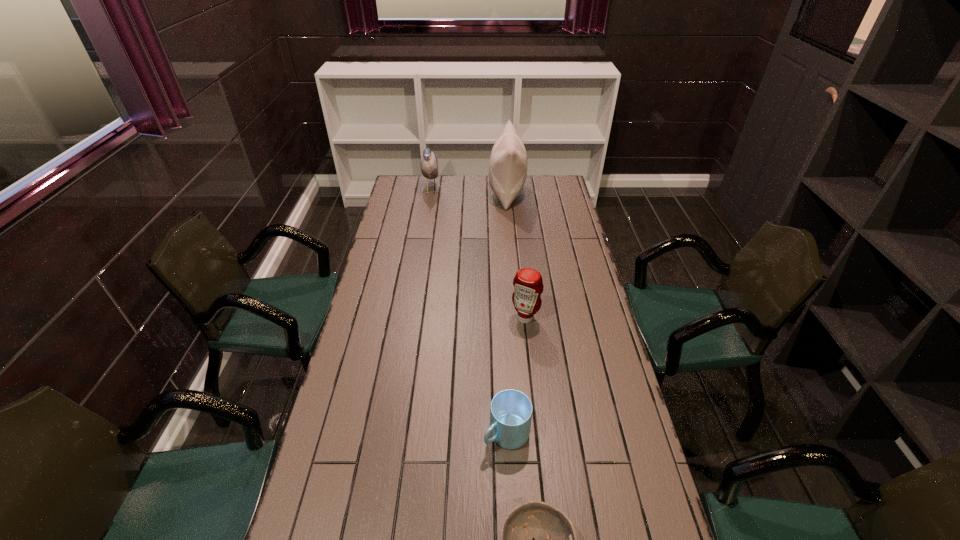
Locate an element on the screen. free space located on the back of the third nearest object is located at coordinates (518, 252).

Find the location of a particular element. free space located 0.280m on the right of the fourth farthest object is located at coordinates pos(628,434).

At what (x,y) coordinates should I click in order to perform the action: click on cushion that is at the far edge. Please return your answer as a coordinate pair (x, y). This screenshot has width=960, height=540. Looking at the image, I should click on (508, 162).

Locate an element on the screen. The width and height of the screenshot is (960, 540). bird that is at the far edge is located at coordinates (429, 165).

Locate an element on the screen. This screenshot has width=960, height=540. object situated at the left edge is located at coordinates (429, 165).

Locate an element on the screen. The height and width of the screenshot is (540, 960). object at the far left corner is located at coordinates (429, 165).

In the image, there is a desktop. Where is `vacant space at the far edge`? This screenshot has width=960, height=540. vacant space at the far edge is located at coordinates (450, 179).

In the image, there is a desktop. Where is `vacant region at the left edge`? The height and width of the screenshot is (540, 960). vacant region at the left edge is located at coordinates (333, 457).

Find the location of a particular element. This screenshot has width=960, height=540. free space at the right edge is located at coordinates (551, 283).

In the image, there is a desktop. What are the coordinates of `vacant area at the far left corner` in the screenshot? It's located at (420, 184).